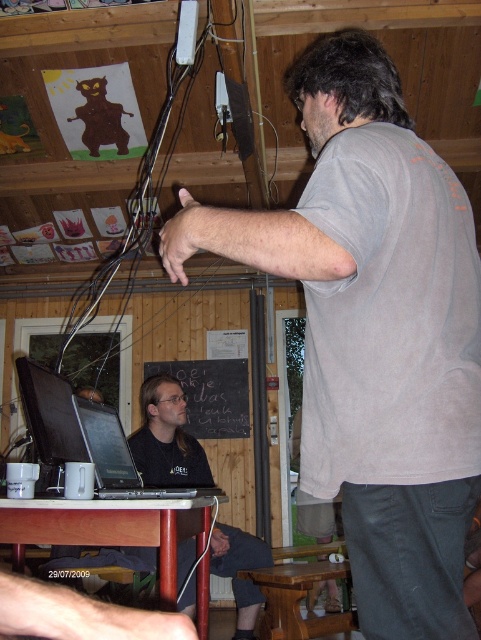
Who is positioned more to the right, black wire at upper center or black chalkboard at center?

From the viewer's perspective, black chalkboard at center appears more on the right side.

Does point (184, 74) come closer to viewer compared to point (243, 369)?

Yes, point (184, 74) is in front of point (243, 369).

Locate an element on the screen. The image size is (481, 640). black wire at upper center is located at coordinates (138, 198).

Does black matte shirt at lower left have a lesser height compared to wooden stool at lower center?

Incorrect, black matte shirt at lower left's height does not fall short of wooden stool at lower center's.

Is black matte shirt at lower left thinner than wooden stool at lower center?

No, black matte shirt at lower left is not thinner than wooden stool at lower center.

Does point (225, 564) come in front of point (269, 573)?

No.

I want to click on black matte shirt at lower left, so click(166, 438).

Between black matte shirt at lower left and black wire at upper center, which one has less height?

With less height is black matte shirt at lower left.

Is black matte shirt at lower left smaller than black wire at upper center?

Indeed, black matte shirt at lower left has a smaller size compared to black wire at upper center.

You are a GUI agent. You are given a task and a screenshot of the screen. Output one action in this format:
    pyautogui.click(x=<x>, y=<y>)
    Task: Click on the black matte shirt at lower left
    Image resolution: width=481 pixels, height=640 pixels.
    Given the screenshot: What is the action you would take?
    pyautogui.click(x=166, y=438)